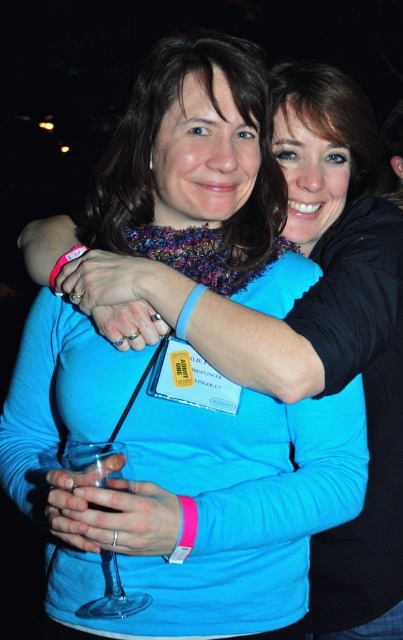
Can you confirm if knitted scarf at center is positioned to the right of matte black hair at upper center?

No, knitted scarf at center is not to the right of matte black hair at upper center.

Who is shorter, knitted scarf at center or matte black hair at upper center?

knitted scarf at center

You are a GUI agent. You are given a task and a screenshot of the screen. Output one action in this format:
    pyautogui.click(x=<x>, y=<y>)
    Task: Click on the knitted scarf at center
    
    Given the screenshot: What is the action you would take?
    pyautogui.click(x=157, y=132)

At what (x,y) coordinates should I click in order to perform the action: click on knitted scarf at center. Please return your answer as a coordinate pair (x, y). This screenshot has width=403, height=640. Looking at the image, I should click on (157, 132).

Who is shorter, knitted scarf at center or transparent glass wine glass at lower left?

With less height is transparent glass wine glass at lower left.

The width and height of the screenshot is (403, 640). What do you see at coordinates (157, 132) in the screenshot?
I see `knitted scarf at center` at bounding box center [157, 132].

Where is `knitted scarf at center`? The image size is (403, 640). knitted scarf at center is located at coordinates (157, 132).

Between point (99, 618) and point (394, 193), which one is positioned behind?

The point (394, 193) is more distant.

Which is in front, point (91, 602) or point (392, 129)?

Point (91, 602) is more forward.

Find the location of a particular element. transparent glass wine glass at lower left is located at coordinates (95, 461).